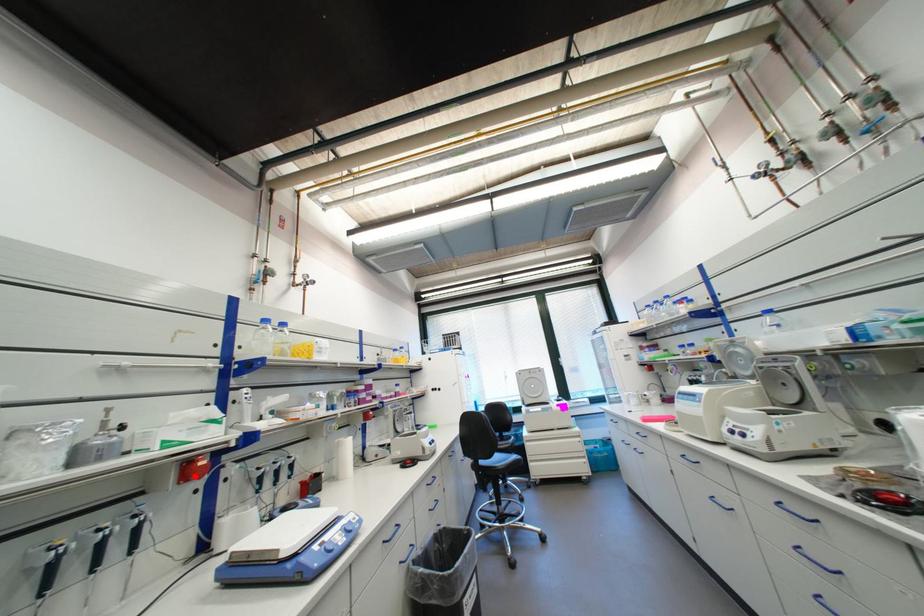
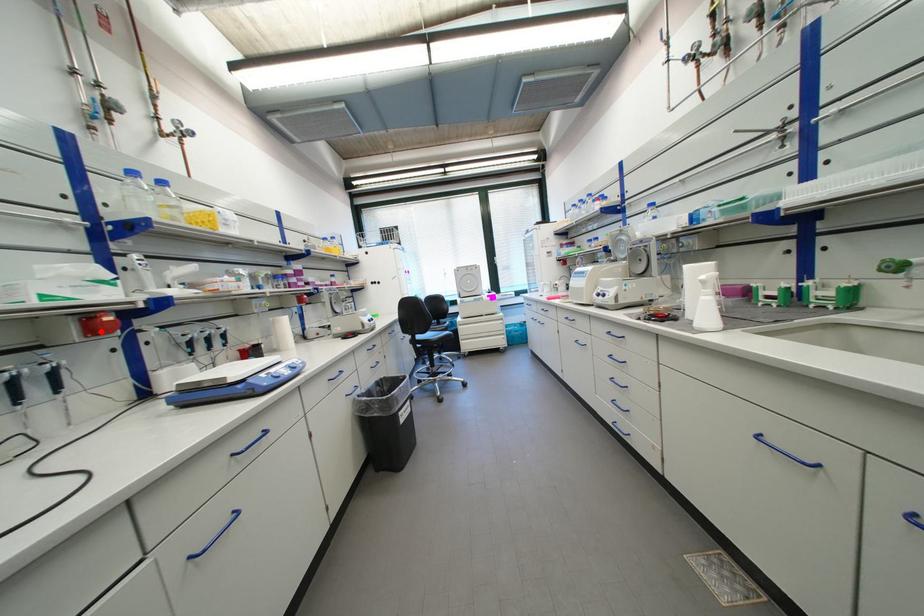
I am providing you with two images of the same scene from different viewpoints. A red point is marked on the first image and another point is marked on the second image. Is the marked point in image1 the same physical position as the marked point in image2?

Yes